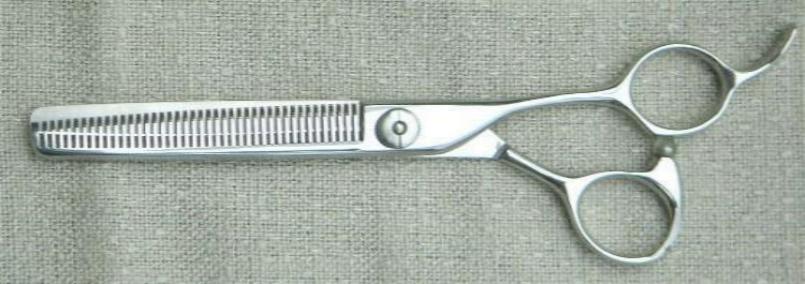
This screenshot has width=805, height=284. Identify the location of cloth cover. (377, 199).